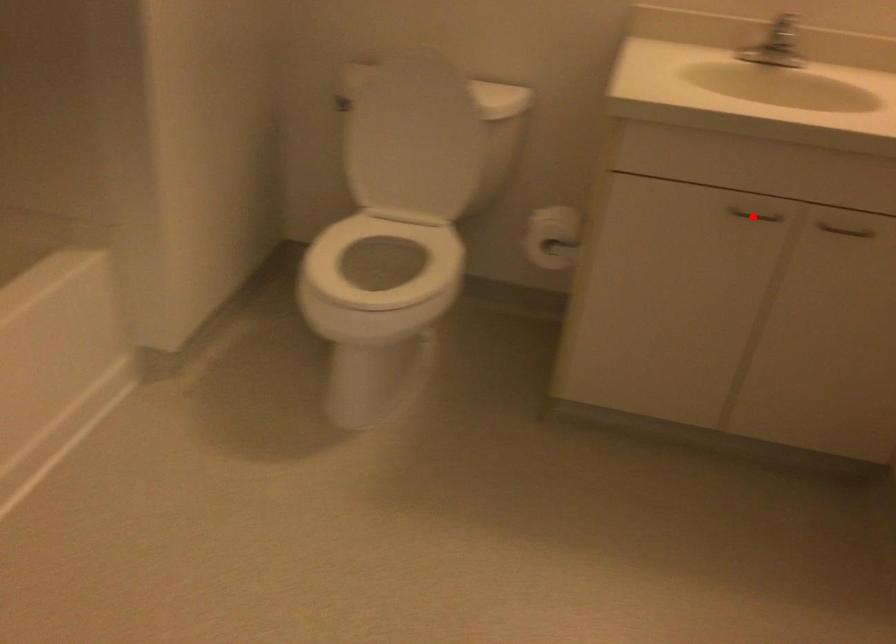
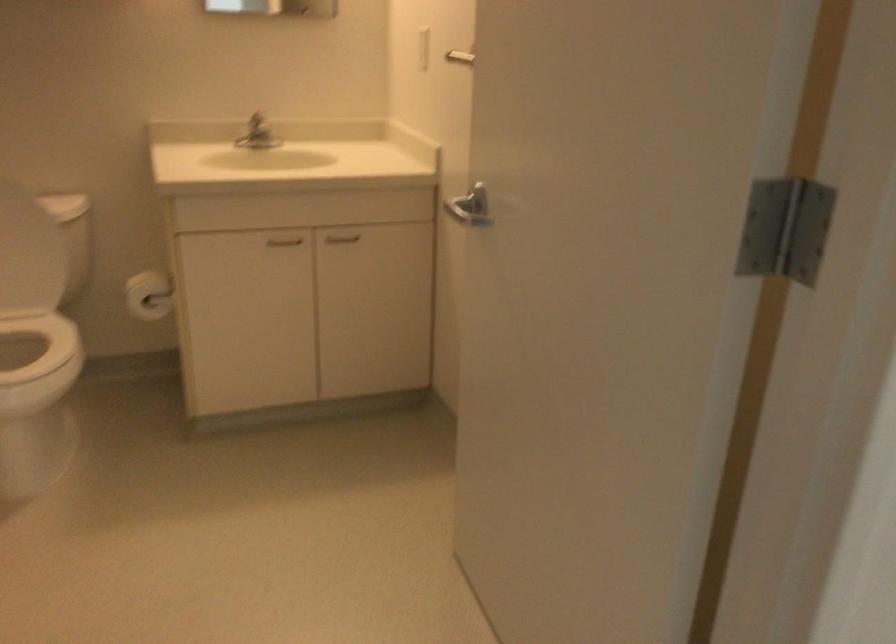
Question: I am providing you with two images of the same scene from different viewpoints. A red point is marked on the first image. Is the red point's position out of view in image 2?

Choices:
 (A) Yes
 (B) No

Answer: (B)